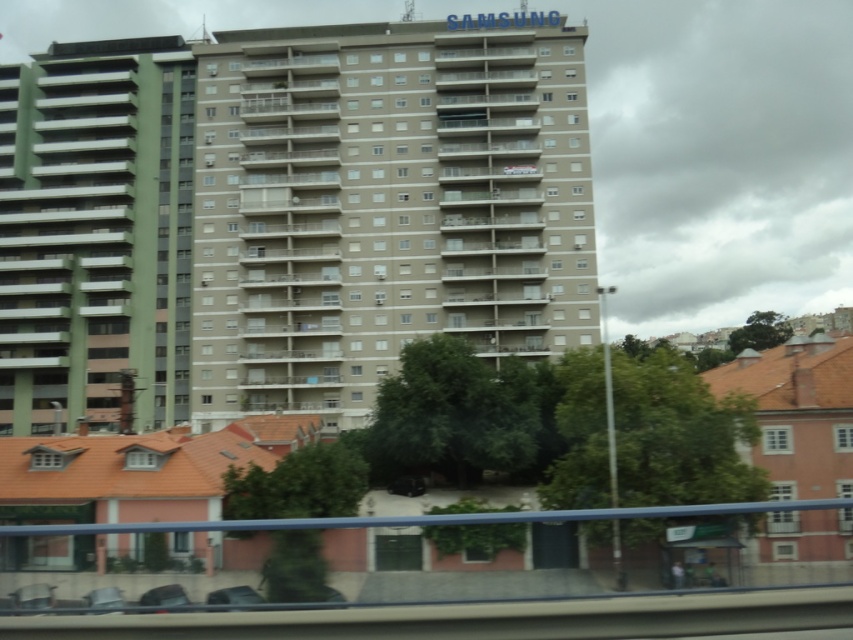
Question: Which point appears closest to the camera in this image?

Choices:
 (A) (6, 323)
 (B) (245, 598)
 (C) (352, 214)

Answer: (B)

Question: Among these objects, which one is nearest to the camera?

Choices:
 (A) green matte building at left
 (B) beige concrete building at center
 (C) metallic gray car at lower center

Answer: (C)

Question: Observing the image, what is the correct spatial positioning of beige concrete building at center in reference to green matte building at left?

Choices:
 (A) left
 (B) right

Answer: (B)

Question: Does beige concrete building at center have a larger size compared to green matte building at left?

Choices:
 (A) no
 (B) yes

Answer: (B)

Question: Which point appears farthest from the camera in this image?

Choices:
 (A) (1, 419)
 (B) (251, 600)

Answer: (A)

Question: Can you confirm if beige concrete building at center is positioned below green matte building at left?

Choices:
 (A) no
 (B) yes

Answer: (A)